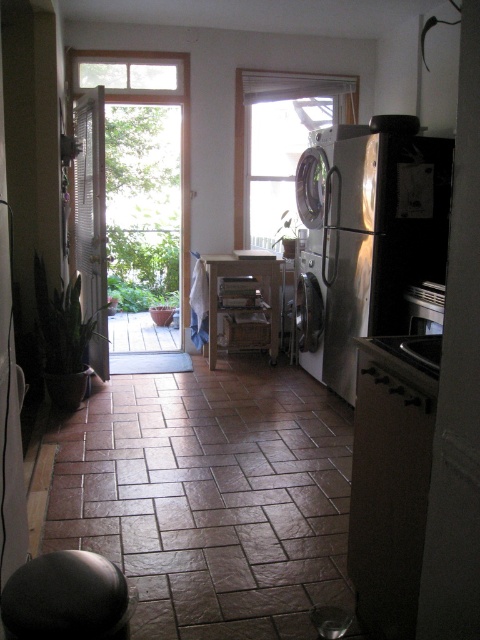
Question: Which point is farther to the camera?

Choices:
 (A) (348, 104)
 (B) (249, 429)

Answer: (A)

Question: Does stainless steel refrigerator at right appear under transparent glass window at center?

Choices:
 (A) no
 (B) yes

Answer: (B)

Question: Among these objects, which one is nearest to the camera?

Choices:
 (A) brown stone tile at lower center
 (B) transparent glass window at center

Answer: (A)

Question: Is stainless steel refrigerator at right wider than transparent glass window at center?

Choices:
 (A) no
 (B) yes

Answer: (A)

Question: Among these points, which one is nearest to the camera?

Choices:
 (A) (241, 145)
 (B) (299, 323)
 (C) (184, 200)

Answer: (B)

Question: Is stainless steel refrigerator at right above transparent glass window at center?

Choices:
 (A) no
 (B) yes

Answer: (A)